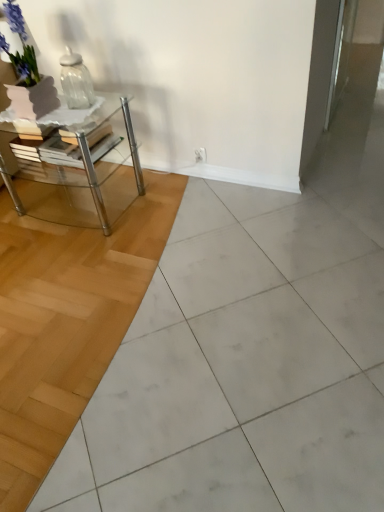
Where is `free space in front of clear glass table at left`? free space in front of clear glass table at left is located at coordinates (85, 258).